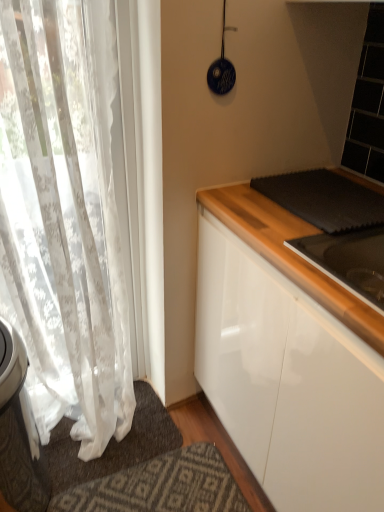
Question: Is white lace curtain at left further to the viewer compared to white fabric doormat at lower left?

Choices:
 (A) yes
 (B) no

Answer: (B)

Question: Is white lace curtain at left bigger than white fabric doormat at lower left?

Choices:
 (A) yes
 (B) no

Answer: (A)

Question: Is white lace curtain at left positioned before white fabric doormat at lower left?

Choices:
 (A) yes
 (B) no

Answer: (A)

Question: From the image's perspective, is white lace curtain at left located above white fabric doormat at lower left?

Choices:
 (A) yes
 (B) no

Answer: (A)

Question: From a real-world perspective, is white lace curtain at left located higher than white fabric doormat at lower left?

Choices:
 (A) yes
 (B) no

Answer: (A)

Question: From the image's perspective, is white lace curtain at left under white fabric doormat at lower left?

Choices:
 (A) no
 (B) yes

Answer: (A)

Question: From the image's perspective, is white fabric doormat at lower left above white lace curtain at left?

Choices:
 (A) no
 (B) yes

Answer: (A)

Question: Does white fabric doormat at lower left have a greater width compared to white lace curtain at left?

Choices:
 (A) no
 (B) yes

Answer: (B)

Question: Can you confirm if white fabric doormat at lower left is positioned to the right of white lace curtain at left?

Choices:
 (A) no
 (B) yes

Answer: (B)

Question: Is white fabric doormat at lower left in front of white lace curtain at left?

Choices:
 (A) no
 (B) yes

Answer: (A)

Question: From a real-world perspective, is white fabric doormat at lower left under white lace curtain at left?

Choices:
 (A) yes
 (B) no

Answer: (A)

Question: From a real-world perspective, is white fabric doormat at lower left physically above white lace curtain at left?

Choices:
 (A) yes
 (B) no

Answer: (B)

Question: Do you think white lace curtain at left is within white fabric doormat at lower left, or outside of it?

Choices:
 (A) outside
 (B) inside

Answer: (A)